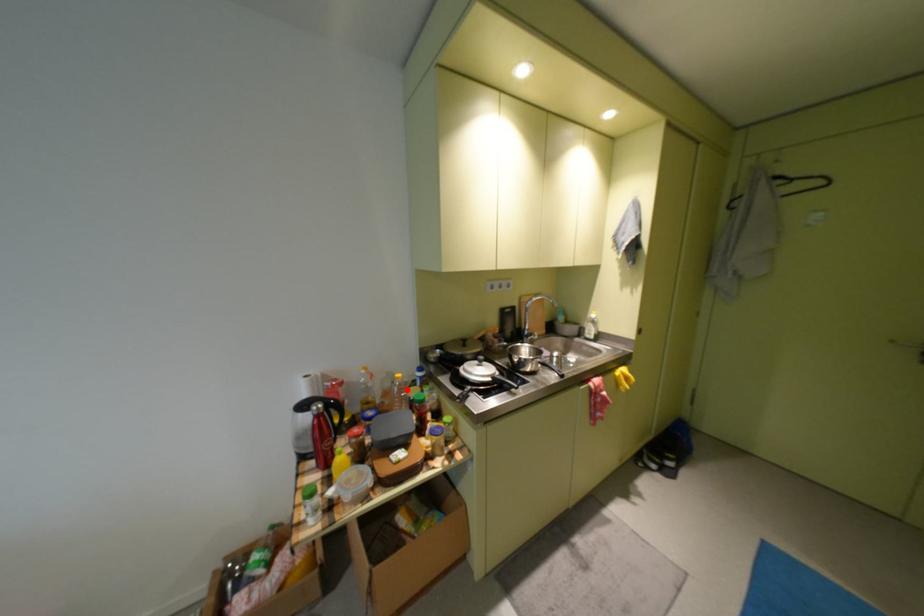
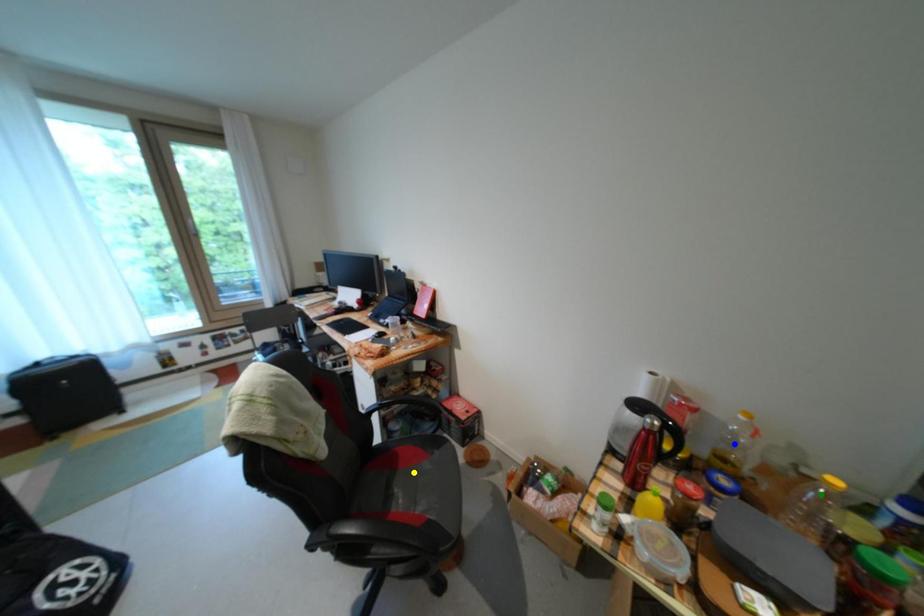
Question: I am providing you with two images of the same scene from different viewpoints. A red point is marked on the first image. You are given multiple points on the second image. Which mark in image 2 goes with the point in image 1?

Choices:
 (A) blue point
 (B) green point
 (C) yellow point

Answer: (B)